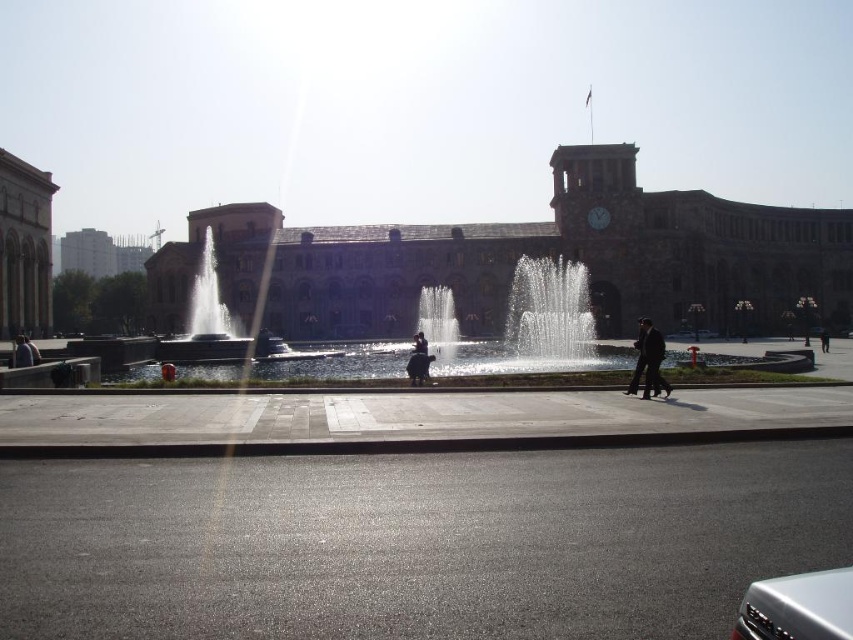
You are an architect designing a new plaza and want to ensure that the fountain will not block the view of the historic building. Based on the image, is the clear glass water at center visible above the dark suit at center? Please explain.

Yes, the clear glass water at center is visible above the dark suit at center, meaning the fountain does not block the view of the historic building as the water is positioned higher than the person in the dark suit.

You are standing in the plaza looking at the historic building. There are two points marked on the ground in front of you. The first point is at coordinates point (418, 336) and the second point is at point (827, 339). If you want to place a small bench between these two points so that it is as close as possible to the historic building, which point should the bench be closer to?

The bench should be placed closer to point (418, 336) because it is nearer to the historic building compared to point (827, 339).